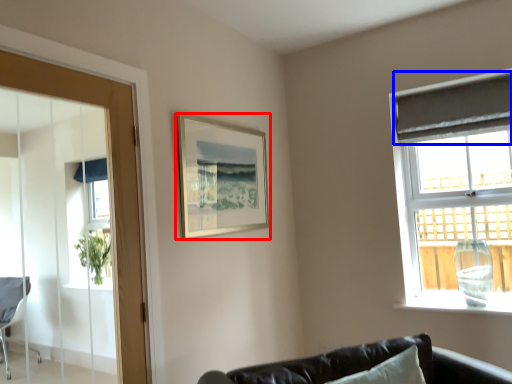
Question: Among these objects, which one is nearest to the camera, picture frame (highlighted by a red box) or curtain (highlighted by a blue box)?

Choices:
 (A) picture frame
 (B) curtain

Answer: (A)